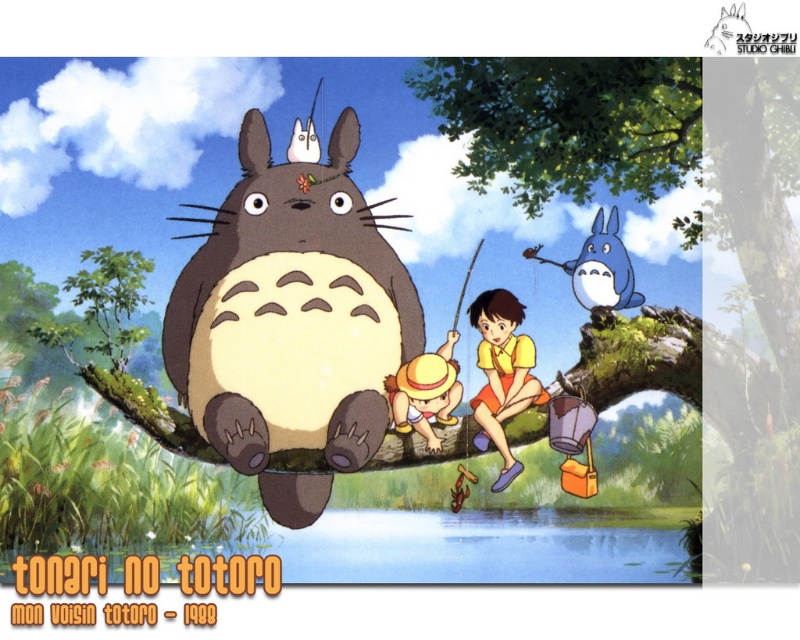
In the scene from My Neighbor Totoro, you are standing in the forest and see the brown fuzzy totoro at center and the yellow matte shorts at center. Which object is positioned higher?

The brown fuzzy totoro at center is above the yellow matte shorts at center, so it is positioned higher.

In the scene from My Neighbor Totoro, there are two Totoro characters visible. The brown fuzzy Totoro at center and the blue matte Totoro at upper center. Which one is bigger?

The brown fuzzy Totoro at center is larger in size than the blue matte Totoro at upper center.